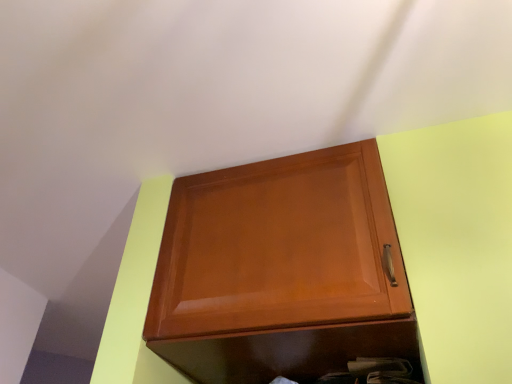
This screenshot has height=384, width=512. What do you see at coordinates (281, 271) in the screenshot?
I see `glossy wood cupboard at upper center` at bounding box center [281, 271].

Identify the location of glossy wood cupboard at upper center. (281, 271).

What are the coordinates of `glossy wood cupboard at upper center` in the screenshot? It's located at (281, 271).